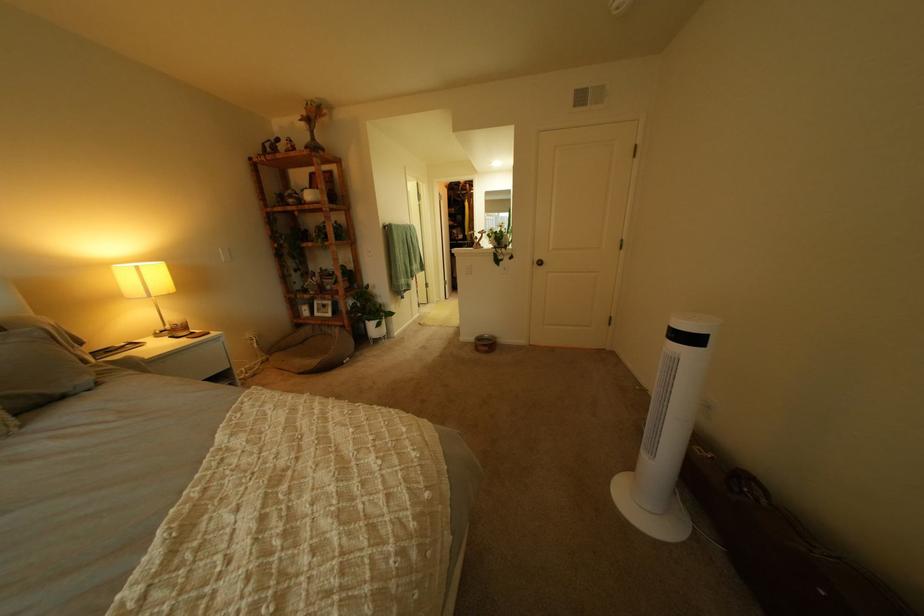
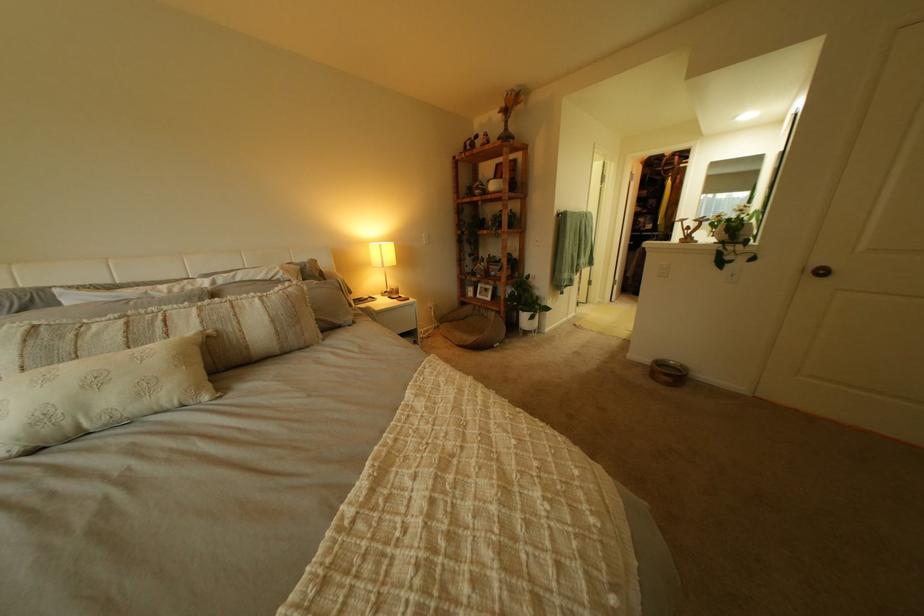
Where in the second image is the point corresponding to the point at 116,265 from the first image?

(381, 244)